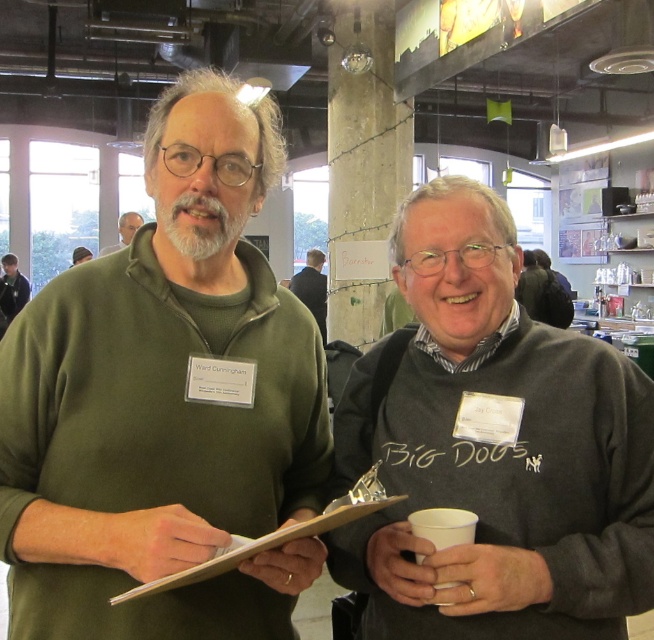
Does green matte sweater at center have a smaller size compared to matte green sweater at center?

Indeed, green matte sweater at center has a smaller size compared to matte green sweater at center.

Is the position of green matte sweater at center less distant than that of matte green sweater at center?

Yes, it is.

The image size is (654, 640). What are the coordinates of `green matte sweater at center` in the screenshot? It's located at (165, 403).

Can you confirm if green matte sweater at center is positioned to the left of dark gray sweater at center?

Indeed, green matte sweater at center is positioned on the left side of dark gray sweater at center.

Is point (18, 362) farther from viewer compared to point (504, 529)?

Yes, point (18, 362) is behind point (504, 529).

From the picture: Who is more forward, (218, 288) or (559, 524)?

Point (559, 524) is in front.

Where is `green matte sweater at center`? green matte sweater at center is located at coordinates (165, 403).

Looking at this image, can you confirm if green matte sweater at center is smaller than dark blue shirt at left?

Yes.

Is point (73, 632) less distant than point (5, 269)?

Yes, point (73, 632) is in front of point (5, 269).

The height and width of the screenshot is (640, 654). What are the coordinates of `green matte sweater at center` in the screenshot? It's located at (165, 403).